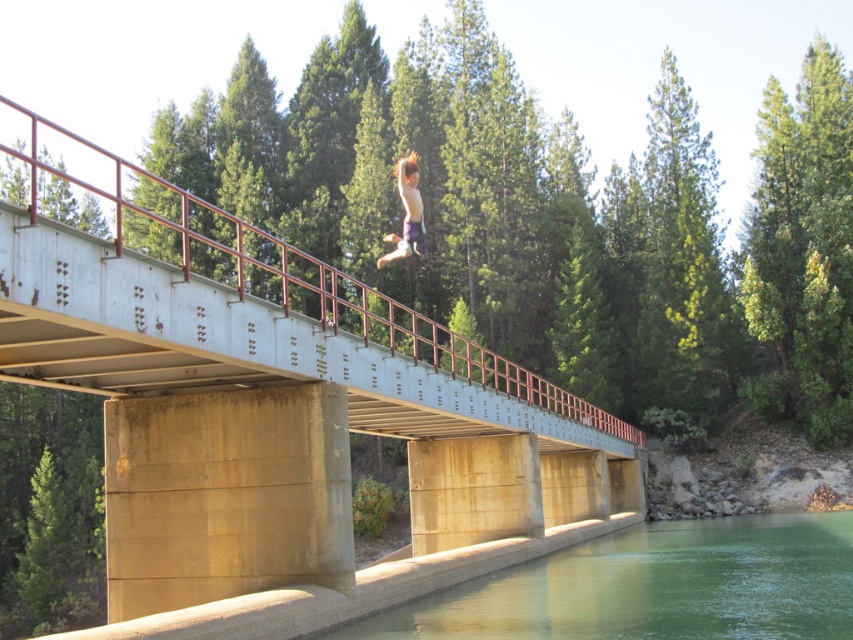
You are a safety inspector evaluating the bridge jump site. The person is jumping from the bridge into the green smooth water at lower center. What is the minimum safe distance required between the jumper and the water to ensure safety?

The minimum safe distance required for a jump into the green smooth water at lower center is typically around 50 feet. Since the jumper is 53.64 feet away from the water, this distance meets the safety requirement.

You are standing at the edge of the bridge and see two points in the scene. The first point is at coordinates point (x=155, y=412) and the second is at point (x=395, y=173). Which point is nearer to you?

Point (x=155, y=412) is closer to the viewer than point (x=395, y=173).

You are a photographer trying to capture the perfect shot of the scene. You notice the concrete bridge at center and the shiny brown hair at center. Which object should you focus on first to ensure both are in the frame?

The concrete bridge at center is closer to the viewer than the shiny brown hair at center, so you should focus on the concrete bridge at center first to ensure both are in the frame.